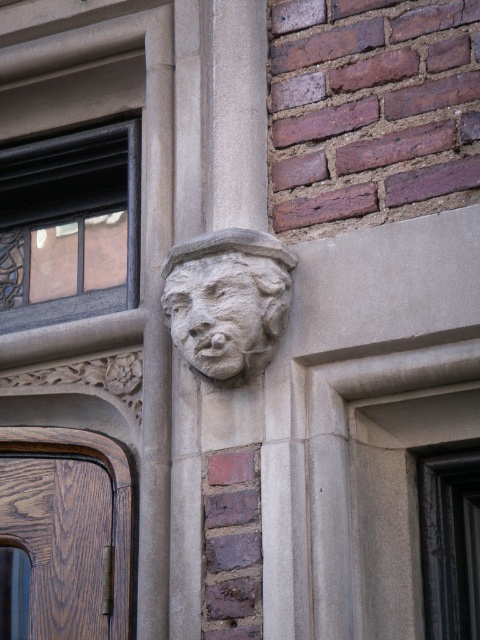
Question: Can you confirm if brown wood door at lower left is positioned to the left of stone carved face at upper center?

Choices:
 (A) yes
 (B) no

Answer: (A)

Question: Is gray stone face at center bigger than stone carved face at upper center?

Choices:
 (A) no
 (B) yes

Answer: (B)

Question: Which point appears closest to the camera in this image?

Choices:
 (A) (173, 321)
 (B) (190, 321)

Answer: (B)

Question: Which point is farther from the camera taking this photo?

Choices:
 (A) (189, 310)
 (B) (46, 458)
 (C) (233, 362)

Answer: (B)

Question: Which point is closer to the camera?

Choices:
 (A) (24, 502)
 (B) (238, 285)

Answer: (B)

Question: Is brown wood door at lower left below gray stone face at center?

Choices:
 (A) yes
 (B) no

Answer: (A)